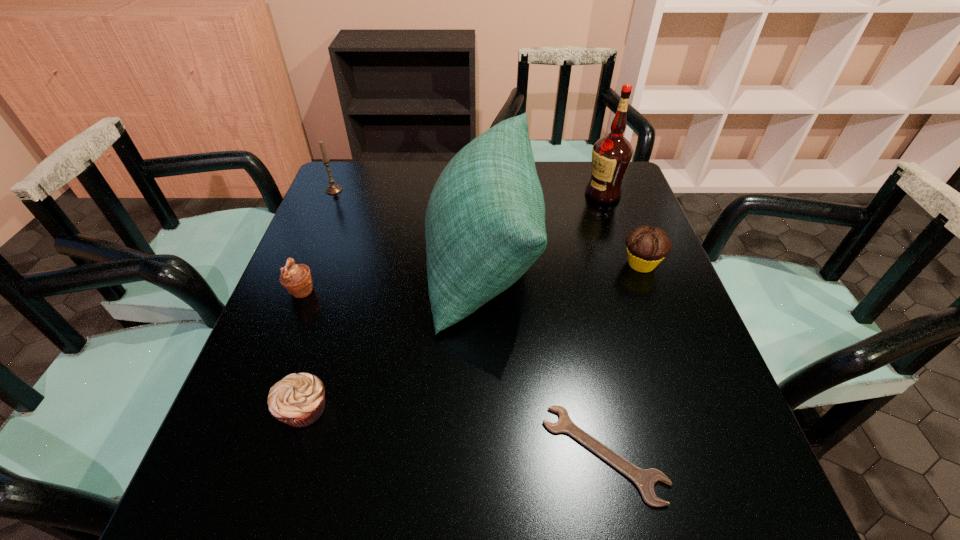
Identify the location of free spot located 0.360m on the label of the alcohol. (466, 194).

Locate an element on the screen. free space located 0.250m on the front-facing side of the second tallest object is located at coordinates (331, 259).

Where is `vacant space located on the front-facing side of the second tallest object`? vacant space located on the front-facing side of the second tallest object is located at coordinates (320, 259).

You are a GUI agent. You are given a task and a screenshot of the screen. Output one action in this format:
    pyautogui.click(x=<x>, y=<y>)
    Task: Click on the vacant space located on the front-facing side of the second tallest object
    The width and height of the screenshot is (960, 540).
    Given the screenshot: What is the action you would take?
    pyautogui.click(x=296, y=259)

Where is `vacant space located 0.360m on the front of the candle`? Image resolution: width=960 pixels, height=540 pixels. vacant space located 0.360m on the front of the candle is located at coordinates (297, 280).

You are a GUI agent. You are given a task and a screenshot of the screen. Output one action in this format:
    pyautogui.click(x=<x>, y=<y>)
    Task: Click on the free space located on the back of the rightmost muffin
    The width and height of the screenshot is (960, 540).
    Given the screenshot: What is the action you would take?
    (x=625, y=222)

At what (x,y) coordinates should I click in order to perform the action: click on vacant space located 0.050m on the right of the second nearest muffin. Please return your answer as a coordinate pair (x, y). Looking at the image, I should click on 337,291.

Find the location of a particular element. This screenshot has width=960, height=540. vacant space positioned 0.050m on the left of the nearest muffin is located at coordinates (251, 409).

Where is `vacant space located 0.130m on the left of the shortest object`? Image resolution: width=960 pixels, height=540 pixels. vacant space located 0.130m on the left of the shortest object is located at coordinates (471, 454).

Locate an element on the screen. alcohol that is at the far edge is located at coordinates (611, 155).